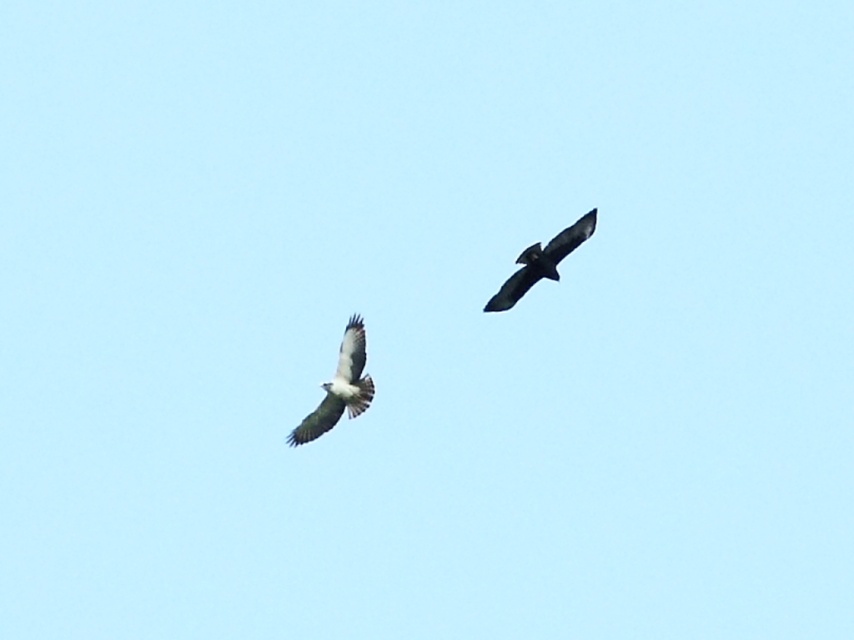
Question: Which object appears closest to the camera in this image?

Choices:
 (A) white feathered eagle at center
 (B) dark brown feathers at upper right

Answer: (B)

Question: Does white feathered eagle at center have a greater width compared to dark brown feathers at upper right?

Choices:
 (A) yes
 (B) no

Answer: (A)

Question: Is white feathered eagle at center in front of dark brown feathers at upper right?

Choices:
 (A) no
 (B) yes

Answer: (A)

Question: Does white feathered eagle at center appear on the right side of dark brown feathers at upper right?

Choices:
 (A) no
 (B) yes

Answer: (A)